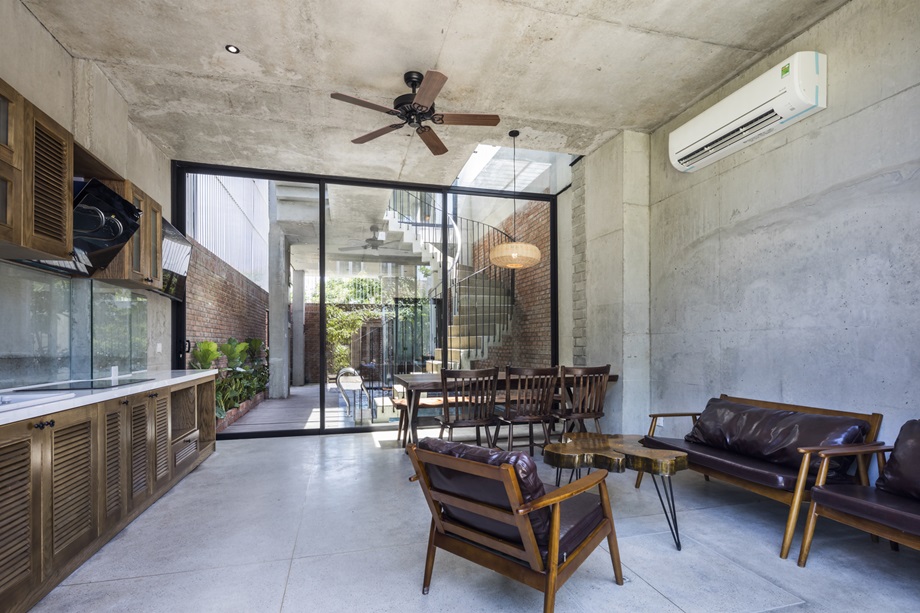
Where is `black door frame`? black door frame is located at coordinates (284, 176), (514, 192), (554, 270), (359, 431), (182, 319).